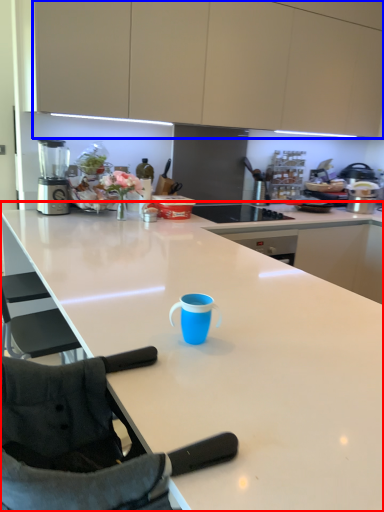
Question: Which object appears closest to the camera in this image, countertop (highlighted by a red box) or cabinetry (highlighted by a blue box)?

Choices:
 (A) countertop
 (B) cabinetry

Answer: (A)